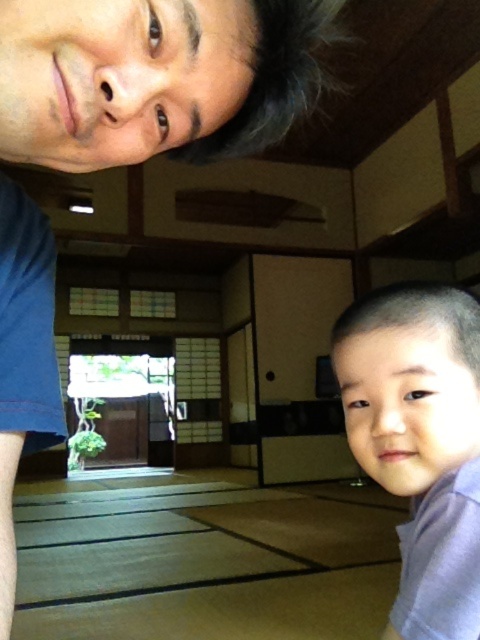
What are the coordinates of the matte blue shirt at upper left in the scene?

The coordinates of the matte blue shirt at upper left are at point (153, 77).

You are a guest in this traditional Japanese room and notice two items in the upper part of the room. One is the matte blue shirt at upper left and the other is the matte black hair at upper center. Which of these two items is taller?

The matte blue shirt at upper left is taller than the matte black hair at upper center according to the description.

You are a guest in a traditional Japanese room and notice two items, the matte blue shirt at upper left and the light purple fabric at lower right. Which item is taller?

The matte blue shirt at upper left is taller than the light purple fabric at lower right.